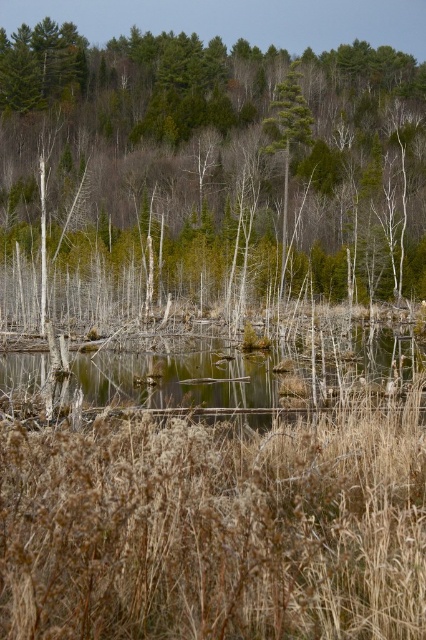
You are standing in the middle of the marshy area and want to reach a point closer to the camera. Which of the two points, point (155, 476) or point (287, 189), should you head towards?

You should head towards point (155, 476) because it is closer to the camera than point (287, 189).

You are a hiker trying to cross the marshy area. You see the brown dry grass at center and the green leafy tree at center. Which one is taller, and why might that matter for your path?

The green leafy tree at center is taller than the brown dry grass at center. This matters because the tree might provide shade or indicate a solid ground area, but the grass height difference doesn